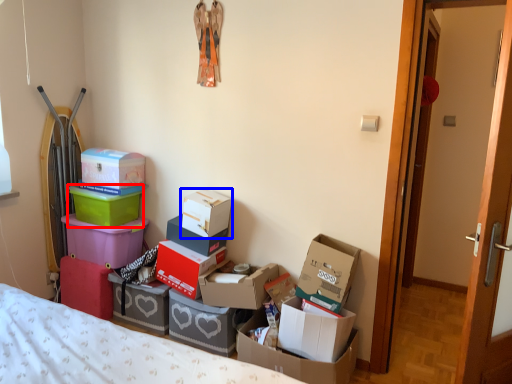
Question: Among these objects, which one is nearest to the camera, box (highlighted by a red box) or box (highlighted by a blue box)?

Choices:
 (A) box
 (B) box

Answer: (B)